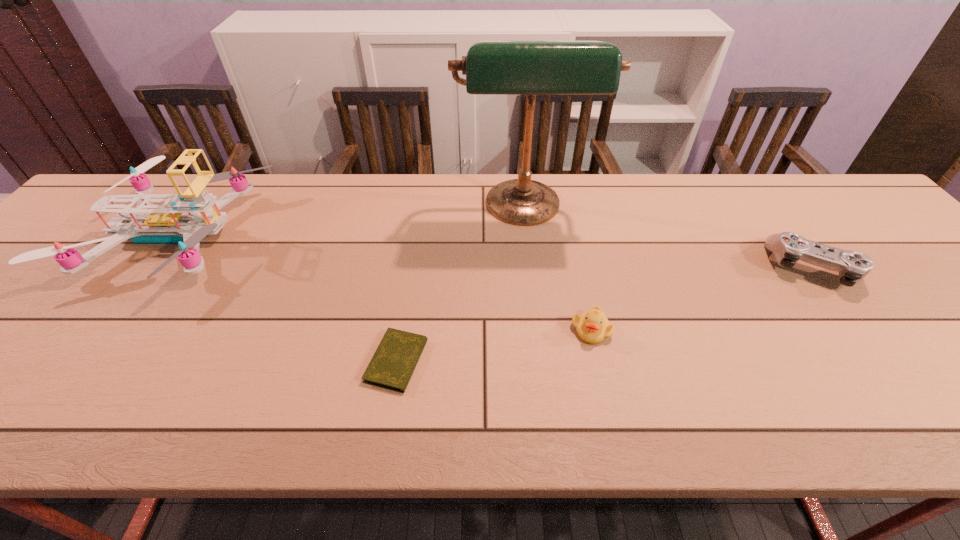
Identify the location of the third closest object to the leftmost object. (593, 327).

At what (x,y) coordinates should I click in order to perform the action: click on free space in the image that satisfies the following two spatial constraints: 1. on the front-facing side of the leftmost object; 2. on the left side of the shortest object. Please return your answer as a coordinate pair (x, y). The height and width of the screenshot is (540, 960). Looking at the image, I should click on (83, 361).

Where is `vacant space that satisfies the following two spatial constraints: 1. above the green lampshade of the table lamp; 2. on the front-facing side of the drone`? Image resolution: width=960 pixels, height=540 pixels. vacant space that satisfies the following two spatial constraints: 1. above the green lampshade of the table lamp; 2. on the front-facing side of the drone is located at coordinates (526, 235).

Find the location of `vacant area that satisfies the following two spatial constraints: 1. above the green lampshade of the table lamp; 2. on the right side of the rightmost object`. vacant area that satisfies the following two spatial constraints: 1. above the green lampshade of the table lamp; 2. on the right side of the rightmost object is located at coordinates (530, 267).

This screenshot has height=540, width=960. I want to click on free spot that satisfies the following two spatial constraints: 1. on the front-facing side of the leftmost object; 2. on the back side of the diary, so click(83, 361).

Where is `blank area in the image that satisfies the following two spatial constraints: 1. on the front-facing side of the leftmost object; 2. on the left side of the rightmost object`? blank area in the image that satisfies the following two spatial constraints: 1. on the front-facing side of the leftmost object; 2. on the left side of the rightmost object is located at coordinates (152, 267).